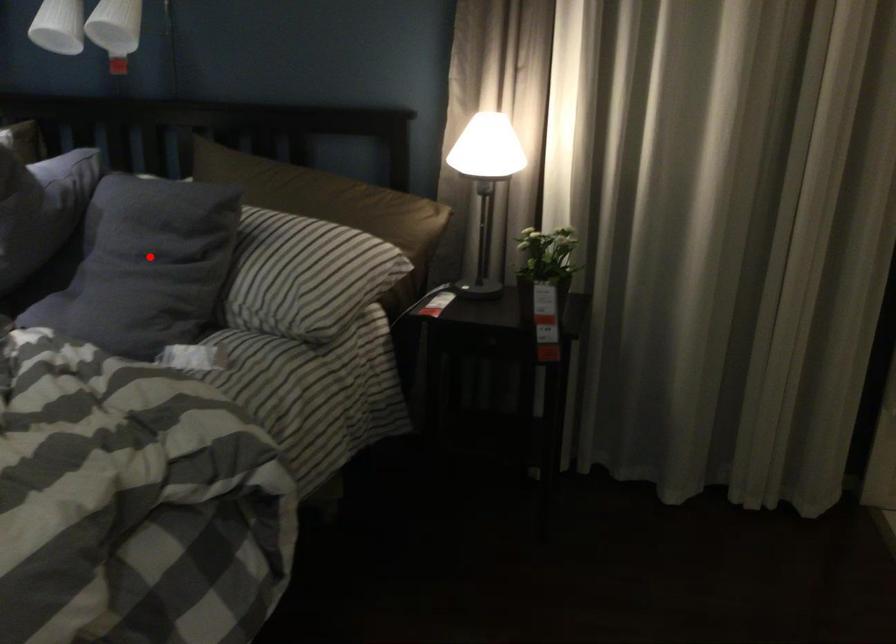
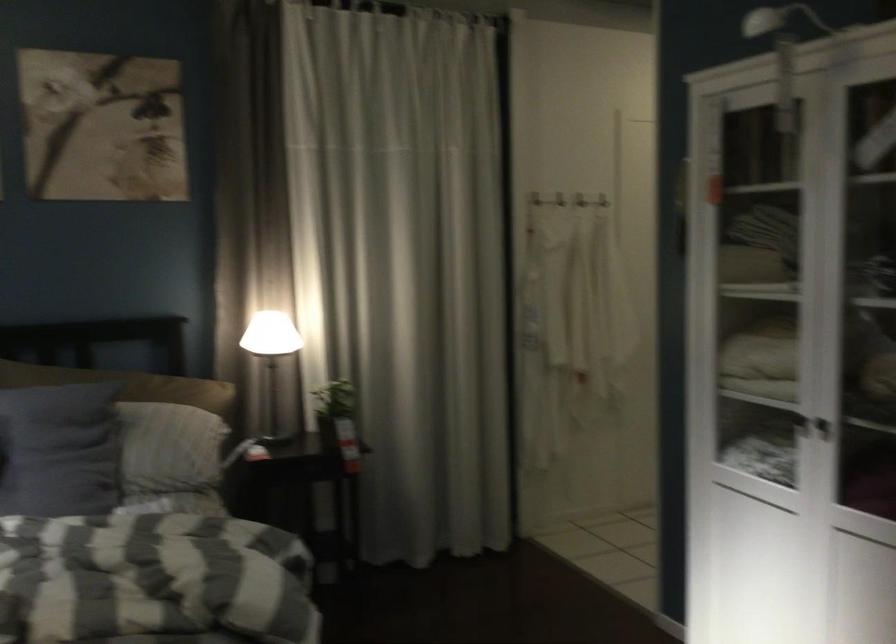
Question: I am providing you with two images of the same scene from different viewpoints. A red point is shown in image1. For the corresponding object point in image2, is it positioned nearer or farther from the camera?

Choices:
 (A) Nearer
 (B) Farther

Answer: (B)